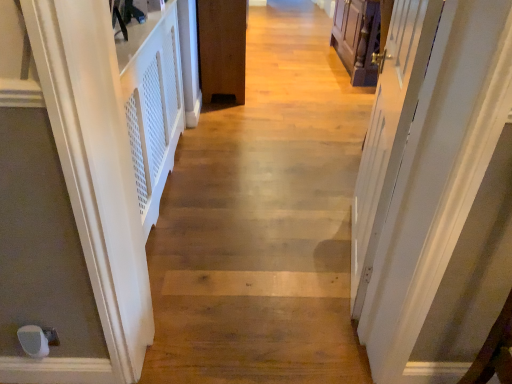
This screenshot has height=384, width=512. I want to click on white matte door at left, the 2th door positioned from the right, so click(x=68, y=200).

Identify the location of brown matte door at center, the 2th door when ordered from left to right. This screenshot has height=384, width=512. (222, 49).

Find the location of a particular element. This screenshot has width=512, height=384. white glossy door at right is located at coordinates (389, 129).

Where is `white matte door at left, the 2th door positioned from the right`? The width and height of the screenshot is (512, 384). white matte door at left, the 2th door positioned from the right is located at coordinates (68, 200).

You are a GUI agent. You are given a task and a screenshot of the screen. Output one action in this format:
    pyautogui.click(x=<x>, y=<y>)
    Task: Click on the path that appears behind the white matte door at left, marked as the second door in a back-to-front arrangement
    Image resolution: width=512 pixels, height=384 pixels.
    Given the screenshot: What is the action you would take?
    pyautogui.click(x=263, y=220)

From a real-world perspective, is natural wood floor at center located beneath white matte door at left, marked as the second door in a back-to-front arrangement?

Yes, from a real-world perspective, natural wood floor at center is under white matte door at left, marked as the second door in a back-to-front arrangement.

Are natural wood floor at center and white matte door at left, marked as the second door in a back-to-front arrangement, making contact?

No, natural wood floor at center is not making contact with white matte door at left, marked as the second door in a back-to-front arrangement.

Considering the points (246, 309) and (58, 190), which point is behind, point (246, 309) or point (58, 190)?

The point (246, 309) is behind.

From the image's perspective, relative to white glossy door at right, is natural wood floor at center above or below?

natural wood floor at center is situated higher than white glossy door at right in the image.

From a real-world perspective, does natural wood floor at center sit lower than white glossy door at right?

Yes, from a real-world perspective, natural wood floor at center is below white glossy door at right.

Based on their sizes in the image, would you say natural wood floor at center is bigger or smaller than white glossy door at right?

natural wood floor at center is bigger than white glossy door at right.

Does point (317, 298) appear closer or farther from the camera than point (367, 153)?

Clearly, point (317, 298) is closer to the camera than point (367, 153).

How distant is white glossy door at right from white matte door at left, the 1th door viewed from the left?

38.43 inches.

Can you confirm if white glossy door at right is wider than white matte door at left, placed as the first door when sorted from front to back?

No.

Which object is closer to the camera taking this photo, white glossy door at right or white matte door at left, the 1th door viewed from the left?

white glossy door at right.

Is white glossy door at right to the right of white matte door at left, marked as the second door in a back-to-front arrangement, from the viewer's perspective?

Yes.

From the image's perspective, is white matte door at left, the 2th door positioned from the right, located beneath natural wood floor at center?

Yes, from the image's perspective, white matte door at left, the 2th door positioned from the right, is below natural wood floor at center.

From a real-world perspective, is white matte door at left, marked as the second door in a back-to-front arrangement, under natural wood floor at center?

No, from a real-world perspective, white matte door at left, marked as the second door in a back-to-front arrangement, is not under natural wood floor at center.

This screenshot has height=384, width=512. I want to click on door in front of the natural wood floor at center, so click(68, 200).

From a real-world perspective, which is physically below, brown matte door at center, the first door positioned from the back, or white glossy door at right?

brown matte door at center, the first door positioned from the back, is physically lower.

Is brown matte door at center, the first door positioned from the back, at the left side of white glossy door at right?

Yes.

Could you tell me if brown matte door at center, the first door when ordered from right to left, is turned towards white glossy door at right?

No, brown matte door at center, the first door when ordered from right to left, is not facing towards white glossy door at right.

How different are the orientations of brown matte door at center, which appears as the second door when viewed from the front, and natural wood floor at center in degrees?

There is a 89-degree angle between the facing directions of brown matte door at center, which appears as the second door when viewed from the front, and natural wood floor at center.

Who is bigger, brown matte door at center, the first door when ordered from right to left, or natural wood floor at center?

Bigger between the two is brown matte door at center, the first door when ordered from right to left.

The image size is (512, 384). I want to click on door that appears above the natural wood floor at center (from the image's perspective), so click(222, 49).

Is natural wood floor at center inside brown matte door at center, the first door positioned from the back?

No, natural wood floor at center is not surrounded by brown matte door at center, the first door positioned from the back.

Is brown matte door at center, the first door when ordered from right to left, next to white matte door at left, marked as the second door in a back-to-front arrangement?

brown matte door at center, the first door when ordered from right to left, is not next to white matte door at left, marked as the second door in a back-to-front arrangement, and they're not touching.

Which is less distant, (204, 61) or (11, 259)?

Point (204, 61) is positioned farther from the camera compared to point (11, 259).

How different are the orientations of brown matte door at center, the 2th door when ordered from left to right, and white matte door at left, the 1th door viewed from the left, in degrees?

They differ by 0.336 degrees in their facing directions.

Considering the relative sizes of brown matte door at center, the 2th door when ordered from left to right, and white matte door at left, the 1th door viewed from the left, in the image provided, is brown matte door at center, the 2th door when ordered from left to right, thinner than white matte door at left, the 1th door viewed from the left,?

No.

Find the location of a particular element. The width and height of the screenshot is (512, 384). door that is below the natural wood floor at center (from the image's perspective) is located at coordinates (68, 200).

Where is `screen door on the right side of natural wood floor at center`? This screenshot has width=512, height=384. screen door on the right side of natural wood floor at center is located at coordinates (389, 129).

Considering their positions, is natural wood floor at center positioned closer to white matte door at left, the 1th door viewed from the left, than brown matte door at center, the first door positioned from the back?

Based on the image, natural wood floor at center appears to be nearer to white matte door at left, the 1th door viewed from the left.

From the image, which object appears to be farther from white glossy door at right, natural wood floor at center or brown matte door at center, which appears as the second door when viewed from the front?

Based on the image, brown matte door at center, which appears as the second door when viewed from the front, appears to be further to white glossy door at right.

Based on their spatial positions, is brown matte door at center, which appears as the second door when viewed from the front, or natural wood floor at center further from white glossy door at right?

brown matte door at center, which appears as the second door when viewed from the front, is positioned further to the anchor white glossy door at right.

Considering their positions, is white glossy door at right positioned closer to brown matte door at center, the first door when ordered from right to left, than natural wood floor at center?

The object closer to brown matte door at center, the first door when ordered from right to left, is natural wood floor at center.

Based on their spatial positions, is white glossy door at right or brown matte door at center, the first door positioned from the back, further from white matte door at left, marked as the second door in a back-to-front arrangement?

Among the two, brown matte door at center, the first door positioned from the back, is located further to white matte door at left, marked as the second door in a back-to-front arrangement.

Estimate the real-world distances between objects in this image. Which object is closer to brown matte door at center, the 2th door when ordered from left to right, white glossy door at right or white matte door at left, the 2th door positioned from the right?

white glossy door at right is positioned closer to the anchor brown matte door at center, the 2th door when ordered from left to right.

Looking at the image, which one is located further to white matte door at left, the 2th door positioned from the right, natural wood floor at center or white glossy door at right?

The object further to white matte door at left, the 2th door positioned from the right, is natural wood floor at center.

Based on their spatial positions, is brown matte door at center, which appears as the second door when viewed from the front, or white matte door at left, marked as the second door in a back-to-front arrangement, further from natural wood floor at center?

Among the two, white matte door at left, marked as the second door in a back-to-front arrangement, is located further to natural wood floor at center.

Image resolution: width=512 pixels, height=384 pixels. Find the location of `path positioned between white glossy door at right and brown matte door at center, the first door positioned from the back, from near to far`. path positioned between white glossy door at right and brown matte door at center, the first door positioned from the back, from near to far is located at coordinates (263, 220).

This screenshot has width=512, height=384. Identify the location of door between white glossy door at right and brown matte door at center, the 2th door when ordered from left to right, along the z-axis. coord(68,200).

Where is `path between white matte door at left, the 2th door positioned from the right, and white glossy door at right, in the horizontal direction`? The image size is (512, 384). path between white matte door at left, the 2th door positioned from the right, and white glossy door at right, in the horizontal direction is located at coordinates (263, 220).

Identify the location of path positioned between white matte door at left, marked as the second door in a back-to-front arrangement, and brown matte door at center, the 2th door when ordered from left to right, from near to far. (263, 220).